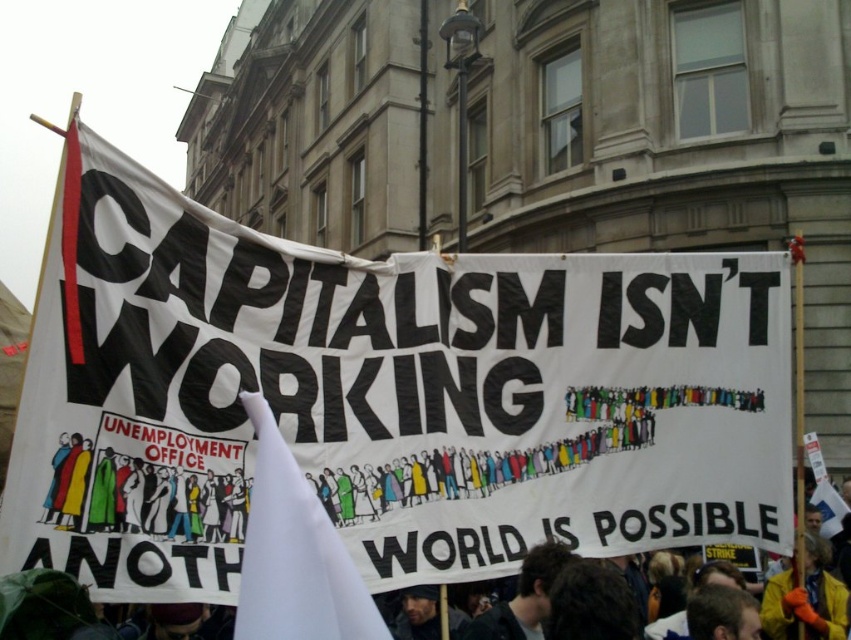
Based on the scene description, where is the white fabric banner at center located in terms of coordinates?

The white fabric banner at center is located at coordinates (381, 397).

You are a photographer trying to capture the entire protest scene. The camera you are using has a maximum focus range of 1.5 meters. Can you take a clear photo of both the white fabric banner at center and the white fabric at center without moving the camera?

The distance between the white fabric banner at center and the white fabric at center is 1.56 meters, which exceeds the camera maximum focus range of 1.5 meters. Therefore, you cannot take a clear photo of both without moving the camera.

Based on the scene description, which object is located above the other between the white fabric banner at center and the white fabric flag at center?

The white fabric banner at center is positioned over the white fabric flag at center, meaning it is above the flag.